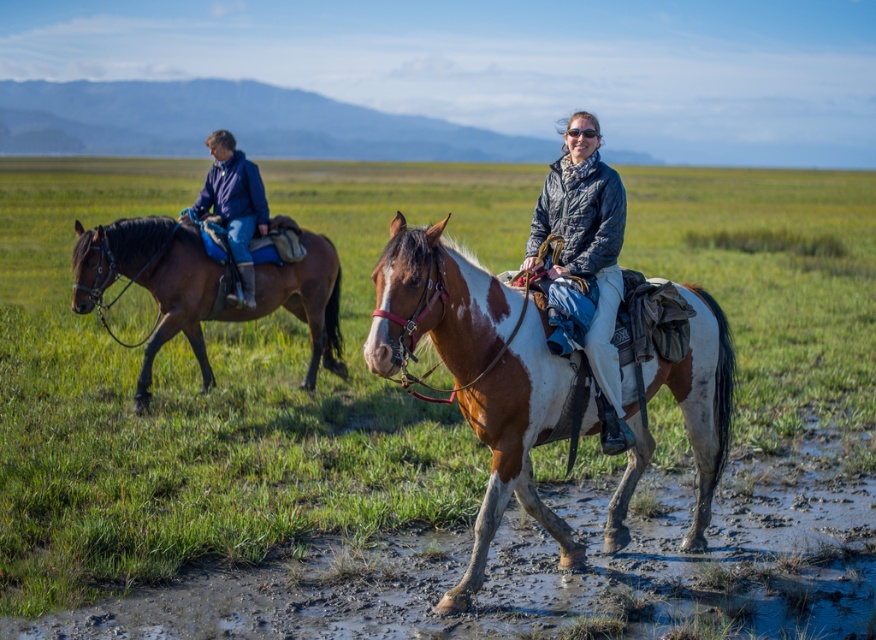
Who is higher up, brown speckled horse at center or blue denim jacket at upper left?

blue denim jacket at upper left

Is brown speckled horse at center to the left of blue denim jacket at upper left from the viewer's perspective?

No, brown speckled horse at center is not to the left of blue denim jacket at upper left.

Between point (387, 269) and point (253, 176), which one is positioned in front?

Point (387, 269) is more forward.

At what (x,y) coordinates should I click in order to perform the action: click on brown speckled horse at center. Please return your answer as a coordinate pair (x, y). Looking at the image, I should click on (477, 372).

In the scene shown: Does green grass at center appear under brown speckled horse at center?

No.

Based on the photo, is green grass at center to the left of brown speckled horse at center from the viewer's perspective?

Indeed, green grass at center is positioned on the left side of brown speckled horse at center.

Is point (869, 346) positioned after point (415, 333)?

Yes, point (869, 346) is farther from viewer.

Image resolution: width=876 pixels, height=640 pixels. I want to click on green grass at center, so click(x=217, y=387).

Is brown speckled horse at center positioned behind brown leather horse at left?

No, brown speckled horse at center is closer to the viewer.

What do you see at coordinates (477, 372) in the screenshot? Image resolution: width=876 pixels, height=640 pixels. I see `brown speckled horse at center` at bounding box center [477, 372].

Locate an element on the screen. The height and width of the screenshot is (640, 876). brown speckled horse at center is located at coordinates (477, 372).